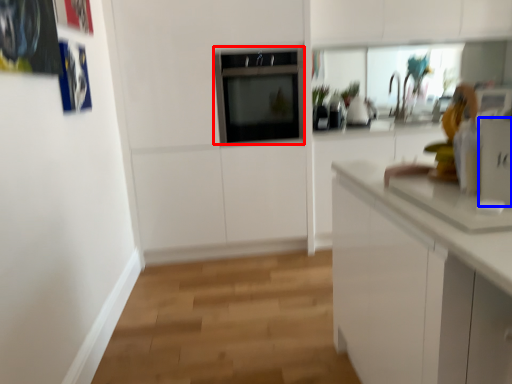
Question: Which point is closer to the camera, oven (highlighted by a red box) or appliance (highlighted by a blue box)?

Choices:
 (A) oven
 (B) appliance

Answer: (B)